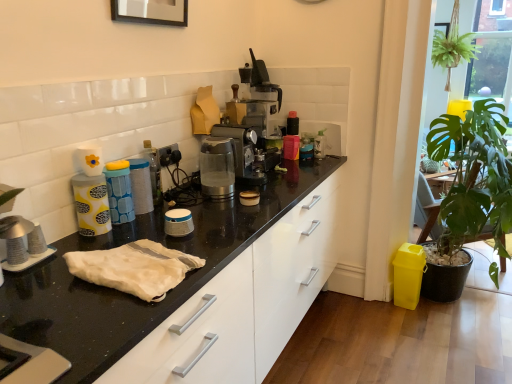
What are the coordinates of `transparent plastic coffee machine at center, the 2th coffee machine in the back-to-front sequence` in the screenshot? It's located at (217, 167).

Measure the distance between transparent plastic coffee machine at center, positioned as the first coffee machine in front-to-back order, and camera.

transparent plastic coffee machine at center, positioned as the first coffee machine in front-to-back order, is 5.88 feet away from camera.

Where is `satin silver coffee machine at center, which is the second coffee machine from front to back`? The height and width of the screenshot is (384, 512). satin silver coffee machine at center, which is the second coffee machine from front to back is located at coordinates (253, 124).

Where is `transparent plastic coffee machine at center, the 2th coffee machine in the back-to-front sequence`? The height and width of the screenshot is (384, 512). transparent plastic coffee machine at center, the 2th coffee machine in the back-to-front sequence is located at coordinates (217, 167).

Is satin silver coffee machine at center, arranged as the 1th coffee machine when viewed from the back, at the back of transparent plastic coffee machine at center, the 2th coffee machine in the back-to-front sequence?

No.

Consider the image. How many degrees apart are the facing directions of transparent plastic coffee machine at center, positioned as the first coffee machine in front-to-back order, and satin silver coffee machine at center, arranged as the 1th coffee machine when viewed from the back?

They differ by 1.69 degrees in their facing directions.

Does transparent plastic coffee machine at center, positioned as the first coffee machine in front-to-back order, have a larger size compared to satin silver coffee machine at center, which is the second coffee machine from front to back?

Incorrect, transparent plastic coffee machine at center, positioned as the first coffee machine in front-to-back order, is not larger than satin silver coffee machine at center, which is the second coffee machine from front to back.

Measure the distance from transparent plastic coffee machine at center, positioned as the first coffee machine in front-to-back order, to satin silver coffee machine at center, arranged as the 1th coffee machine when viewed from the back.

transparent plastic coffee machine at center, positioned as the first coffee machine in front-to-back order, and satin silver coffee machine at center, arranged as the 1th coffee machine when viewed from the back, are 8.22 inches apart from each other.

Considering the relative sizes of satin silver coffee machine at center, arranged as the 1th coffee machine when viewed from the back, and transparent plastic coffee machine at center, the 2th coffee machine in the back-to-front sequence, in the image provided, is satin silver coffee machine at center, arranged as the 1th coffee machine when viewed from the back, shorter than transparent plastic coffee machine at center, the 2th coffee machine in the back-to-front sequence,?

No, satin silver coffee machine at center, arranged as the 1th coffee machine when viewed from the back, is not shorter than transparent plastic coffee machine at center, the 2th coffee machine in the back-to-front sequence.

Is point (254, 85) positioned in front of point (216, 151)?

No, it is behind (216, 151).

Is satin silver coffee machine at center, which is the second coffee machine from front to back, in front of or behind transparent plastic coffee machine at center, the 2th coffee machine in the back-to-front sequence, in the image?

Clearly, satin silver coffee machine at center, which is the second coffee machine from front to back, is behind transparent plastic coffee machine at center, the 2th coffee machine in the back-to-front sequence.

How much distance is there between satin silver coffee machine at center, which is the second coffee machine from front to back, and transparent plastic coffee machine at center, the 2th coffee machine in the back-to-front sequence?

satin silver coffee machine at center, which is the second coffee machine from front to back, and transparent plastic coffee machine at center, the 2th coffee machine in the back-to-front sequence, are 8.22 inches apart from each other.

Which is more to the right, white fabric at center or green leafy plant at right?

green leafy plant at right.

Could you tell me if white fabric at center is turned towards green leafy plant at right?

No, white fabric at center does not turn towards green leafy plant at right.

Considering the sizes of objects white fabric at center and green leafy plant at right in the image provided, who is wider, white fabric at center or green leafy plant at right?

green leafy plant at right is wider.

Is white fabric at center bigger than green leafy plant at right?

No.

From the picture: Between transparent plastic coffee machine at center, positioned as the first coffee machine in front-to-back order, and green leafy plant at upper right, which one is positioned in front?

transparent plastic coffee machine at center, positioned as the first coffee machine in front-to-back order.

From the image's perspective, is transparent plastic coffee machine at center, positioned as the first coffee machine in front-to-back order, located above green leafy plant at upper right?

No.

Is there a large distance between transparent plastic coffee machine at center, positioned as the first coffee machine in front-to-back order, and green leafy plant at upper right?

Indeed, transparent plastic coffee machine at center, positioned as the first coffee machine in front-to-back order, is not near green leafy plant at upper right.

There is a green leafy plant at upper right. Identify the location of the 2nd coffee machine below it (from the image's perspective). The width and height of the screenshot is (512, 384). point(217,167).

Is satin silver coffee machine at center, arranged as the 1th coffee machine when viewed from the back, located outside green leafy plant at right?

A: Yes, satin silver coffee machine at center, arranged as the 1th coffee machine when viewed from the back, is located beyond the bounds of green leafy plant at right.

Which object is positioned more to the right, satin silver coffee machine at center, which is the second coffee machine from front to back, or green leafy plant at right?

green leafy plant at right.

From the picture: Considering the relative sizes of satin silver coffee machine at center, arranged as the 1th coffee machine when viewed from the back, and green leafy plant at right in the image provided, is satin silver coffee machine at center, arranged as the 1th coffee machine when viewed from the back, shorter than green leafy plant at right?

Yes.

Identify the location of houseplant on the right side of satin silver coffee machine at center, which is the second coffee machine from front to back. The width and height of the screenshot is (512, 384). (474, 176).

From the picture: Between white fabric at center and green leafy plant at upper right, which one has smaller width?

white fabric at center is thinner.

Is green leafy plant at upper right at the back of white fabric at center?

No.

Is point (104, 267) positioned after point (464, 55)?

No.

Considering the sizes of objects white fabric at center and green leafy plant at upper right in the image provided, who is smaller, white fabric at center or green leafy plant at upper right?

white fabric at center is smaller.

Who is shorter, green leafy plant at right or satin silver coffee machine at center, which is the second coffee machine from front to back?

satin silver coffee machine at center, which is the second coffee machine from front to back, is shorter.

Is point (471, 210) positioned after point (215, 133)?

Yes, point (471, 210) is behind point (215, 133).

From a real-world perspective, which coffee machine is the 2nd one above the green leafy plant at right? Please provide its 2D coordinates.

[(253, 124)]

Which is correct: green leafy plant at right is inside satin silver coffee machine at center, which is the second coffee machine from front to back, or outside of it?

green leafy plant at right cannot be found inside satin silver coffee machine at center, which is the second coffee machine from front to back.

Locate an element on the screen. This screenshot has height=384, width=512. coffee machine located on the left of satin silver coffee machine at center, which is the second coffee machine from front to back is located at coordinates (217, 167).

Find the location of `coffee machine in front of the satin silver coffee machine at center, which is the second coffee machine from front to back`. coffee machine in front of the satin silver coffee machine at center, which is the second coffee machine from front to back is located at coordinates (217, 167).

Looking at the image, which one is located closer to green leafy plant at right, transparent plastic coffee machine at center, the 2th coffee machine in the back-to-front sequence, or green leafy plant at upper right?

Based on the image, transparent plastic coffee machine at center, the 2th coffee machine in the back-to-front sequence, appears to be nearer to green leafy plant at right.

Which object lies further to the anchor point white fabric at center, green leafy plant at upper right or green leafy plant at right?

The object further to white fabric at center is green leafy plant at upper right.

From the image, which object appears to be farther from green leafy plant at upper right, green leafy plant at right or white fabric at center?

white fabric at center is further to green leafy plant at upper right.

Considering their positions, is green leafy plant at right positioned further to satin silver coffee machine at center, which is the second coffee machine from front to back, than white fabric at center?

green leafy plant at right is further to satin silver coffee machine at center, which is the second coffee machine from front to back.

When comparing their distances from green leafy plant at upper right, does transparent plastic coffee machine at center, positioned as the first coffee machine in front-to-back order, or green leafy plant at right seem closer?

green leafy plant at right is closer to green leafy plant at upper right.

Based on their spatial positions, is green leafy plant at upper right or white fabric at center closer to satin silver coffee machine at center, which is the second coffee machine from front to back?

white fabric at center is closer to satin silver coffee machine at center, which is the second coffee machine from front to back.

Which object lies nearer to the anchor point green leafy plant at upper right, transparent plastic coffee machine at center, the 2th coffee machine in the back-to-front sequence, or white fabric at center?

transparent plastic coffee machine at center, the 2th coffee machine in the back-to-front sequence, is closer to green leafy plant at upper right.

Looking at the image, which one is located closer to white fabric at center, green leafy plant at upper right or transparent plastic coffee machine at center, the 2th coffee machine in the back-to-front sequence?

Among the two, transparent plastic coffee machine at center, the 2th coffee machine in the back-to-front sequence, is located nearer to white fabric at center.

Identify the location of coffee machine between transparent plastic coffee machine at center, the 2th coffee machine in the back-to-front sequence, and green leafy plant at upper right. (253, 124).

I want to click on houseplant positioned between white fabric at center and green leafy plant at upper right from near to far, so click(474, 176).

The image size is (512, 384). In order to click on coffee machine between white fabric at center and satin silver coffee machine at center, arranged as the 1th coffee machine when viewed from the back, along the z-axis in this screenshot , I will do `click(217, 167)`.

Identify the location of coffee machine between transparent plastic coffee machine at center, the 2th coffee machine in the back-to-front sequence, and green leafy plant at right. (253, 124).